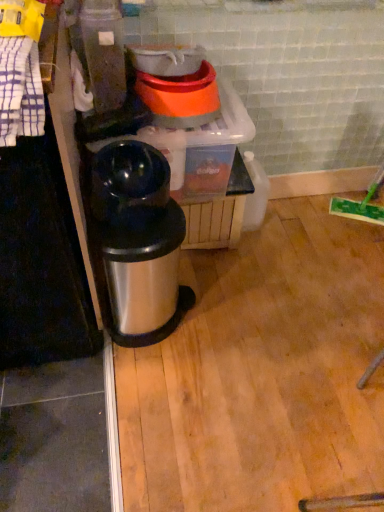
You are a GUI agent. You are given a task and a screenshot of the screen. Output one action in this format:
    pyautogui.click(x=<x>, y=<y>)
    Task: Click on the free point above white checkered towel at left (from a real-world perspective)
    This screenshot has width=384, height=512.
    Given the screenshot: What is the action you would take?
    pyautogui.click(x=17, y=49)